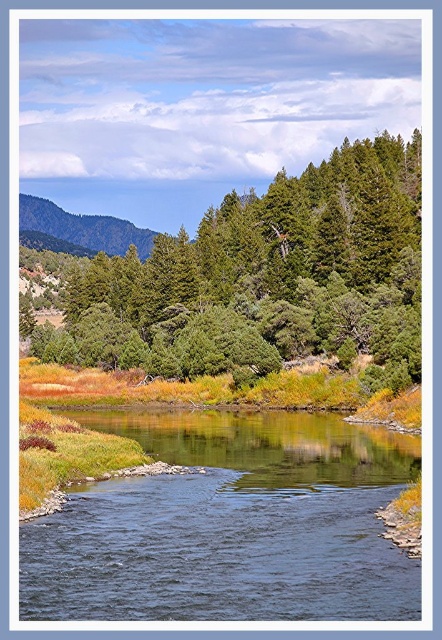
You are standing at the edge of the river and want to look at the green forested mountain at upper left. Which direction should you look relative to the blue smooth water at center?

You should look upward from the blue smooth water at center to see the green forested mountain at upper left since it is located above the water.